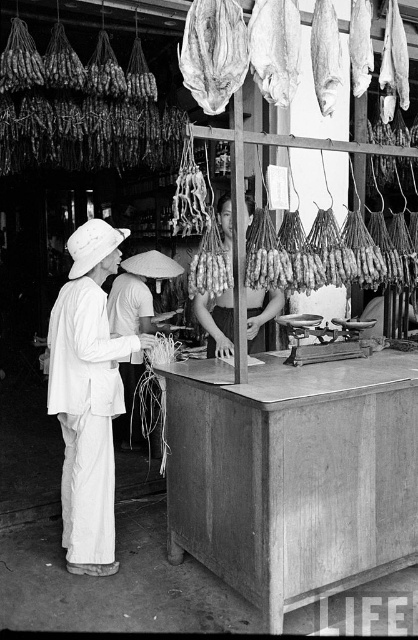
Question: Considering the real-world distances, which object is farthest from the white woven hat at center?

Choices:
 (A) white fabric apron at center
 (B) white cotton hat at left

Answer: (B)

Question: Which of the following is the farthest from the observer?

Choices:
 (A) white fabric apron at center
 (B) smooth skin woman at center
 (C) white cotton hat at left
 (D) dried fish at upper center

Answer: (A)

Question: Is white cotton hat at left smaller than white fabric apron at center?

Choices:
 (A) yes
 (B) no

Answer: (B)

Question: Is white woven hat at center further to camera compared to white fabric apron at center?

Choices:
 (A) yes
 (B) no

Answer: (A)

Question: Which point appears farthest from the camera in this image?

Choices:
 (A) (130, 413)
 (B) (214, 317)
 (C) (193, 10)
 (D) (219, 308)

Answer: (A)

Question: Can you confirm if shiny silver fish at upper center is positioned above white woven hat at center?

Choices:
 (A) no
 (B) yes

Answer: (B)